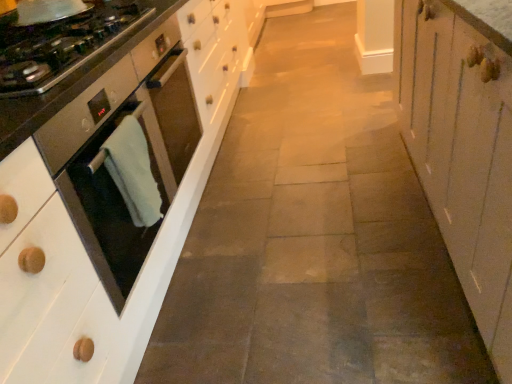
Question: From a real-world perspective, is satin black oven at left positioned above or below satin steel oven at left?

Choices:
 (A) above
 (B) below

Answer: (A)

Question: From the image's perspective, relative to satin steel oven at left, is satin black oven at left above or below?

Choices:
 (A) above
 (B) below

Answer: (B)

Question: Estimate the real-world distances between objects in this image. Which object is farther from the satin black oven at left?

Choices:
 (A) green towel at left
 (B) white wood cabinet at right
 (C) satin steel oven at left

Answer: (B)

Question: Estimate the real-world distances between objects in this image. Which object is farther from the satin steel oven at left?

Choices:
 (A) green towel at left
 (B) white wood cabinet at right
 (C) satin black oven at left

Answer: (B)